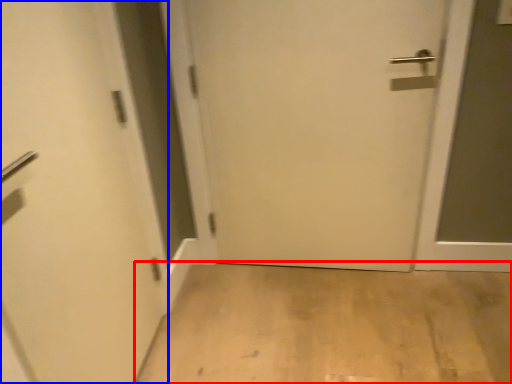
Question: Among these objects, which one is farthest to the camera, corridor (highlighted by a red box) or door (highlighted by a blue box)?

Choices:
 (A) corridor
 (B) door

Answer: (A)